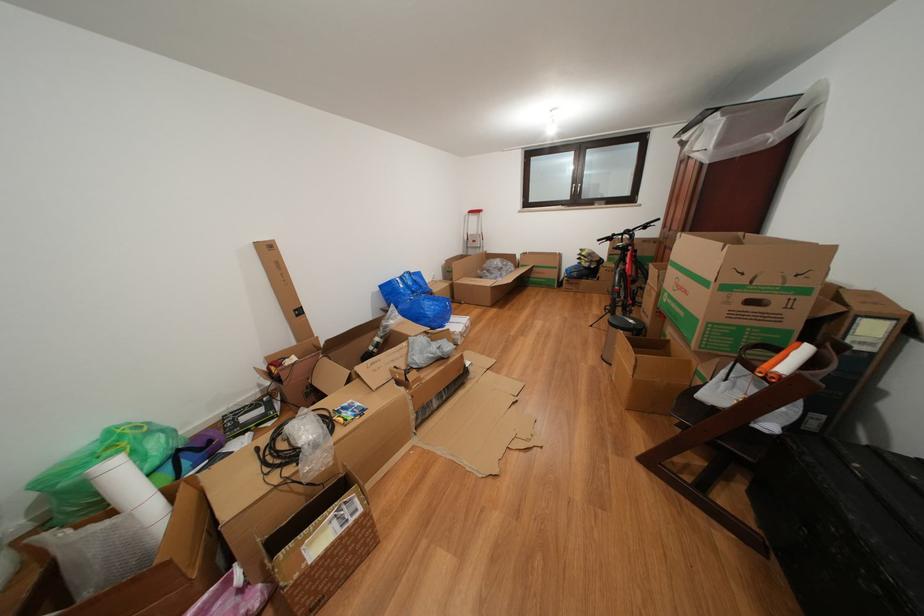
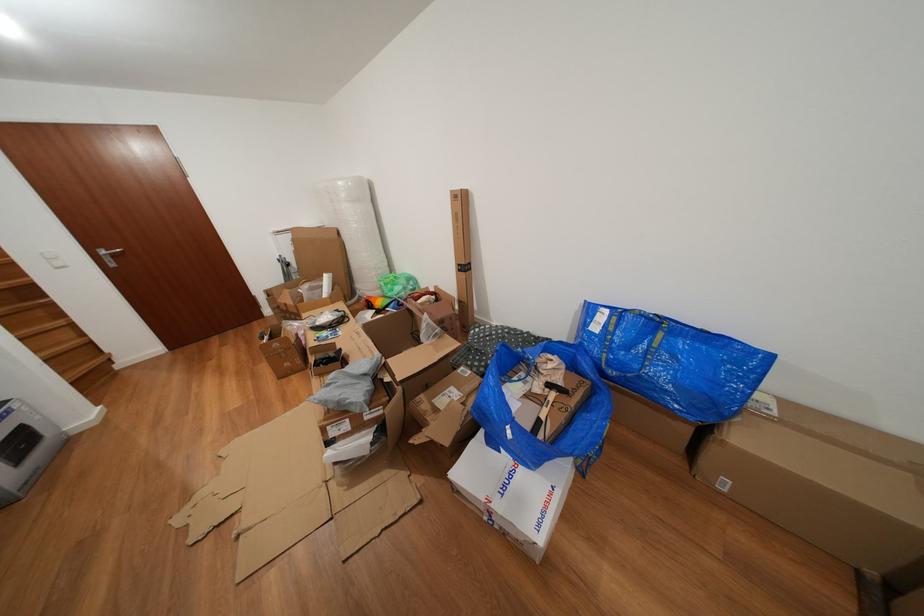
Find the pixel in the second image that matches point (418, 278) in the first image.

(663, 328)